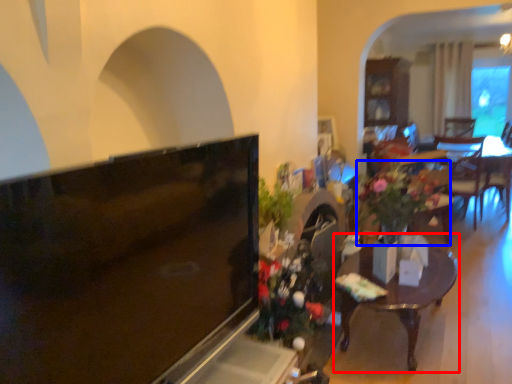
Question: Which object is further to the camera taking this photo, table (highlighted by a red box) or houseplant (highlighted by a blue box)?

Choices:
 (A) table
 (B) houseplant

Answer: (B)